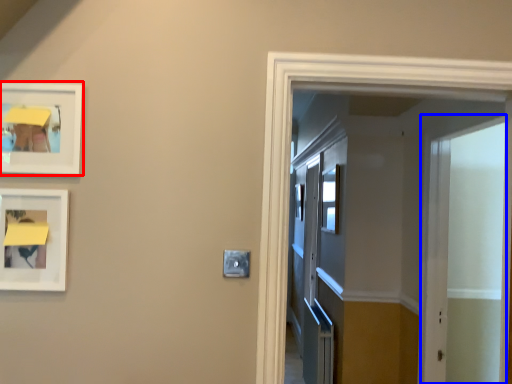
Question: Which object appears farthest to the camera in this image, picture frame (highlighted by a red box) or screen door (highlighted by a blue box)?

Choices:
 (A) picture frame
 (B) screen door

Answer: (B)